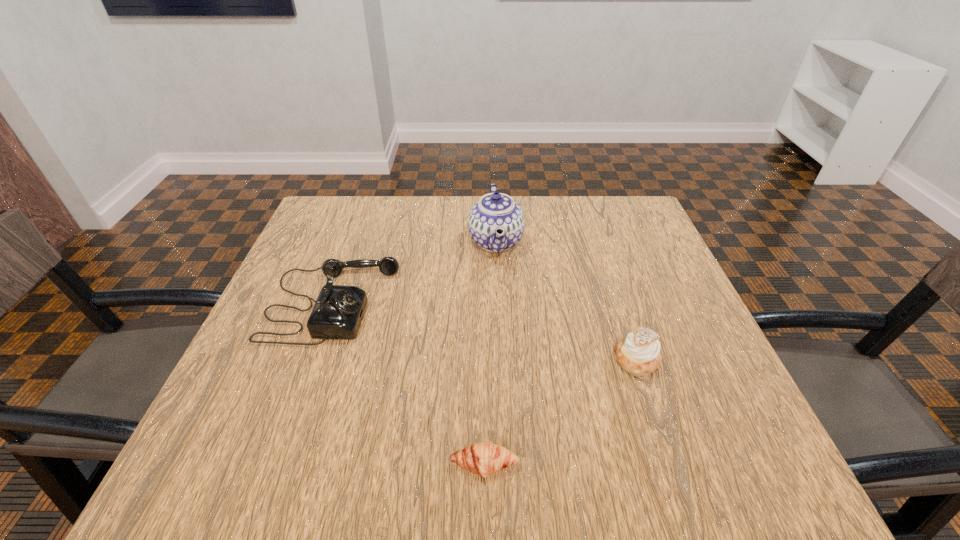
Find the location of a particular element. The image size is (960, 540). vacant area located 0.330m on the dial of the leftmost object is located at coordinates (548, 303).

Locate an element on the screen. Image resolution: width=960 pixels, height=540 pixels. vacant space located on the left of the rightmost object is located at coordinates (509, 359).

At what (x,y) coordinates should I click in order to perform the action: click on object that is at the far edge. Please return your answer as a coordinate pair (x, y). The width and height of the screenshot is (960, 540). Looking at the image, I should click on [x=496, y=222].

Image resolution: width=960 pixels, height=540 pixels. I want to click on object located in the near edge section of the desktop, so click(x=482, y=458).

What are the coordinates of `object that is at the left edge` in the screenshot? It's located at (338, 311).

In order to click on object that is at the right edge in this screenshot , I will do `click(638, 354)`.

Where is `free region at the far edge of the desktop`? The width and height of the screenshot is (960, 540). free region at the far edge of the desktop is located at coordinates pyautogui.click(x=368, y=246).

Find the location of a particular element. The height and width of the screenshot is (540, 960). blank area at the near edge is located at coordinates (381, 469).

Locate an element on the screen. Image resolution: width=960 pixels, height=540 pixels. free space at the left edge is located at coordinates (279, 311).

Locate an element on the screen. The width and height of the screenshot is (960, 540). blank area at the right edge is located at coordinates [x=621, y=258].